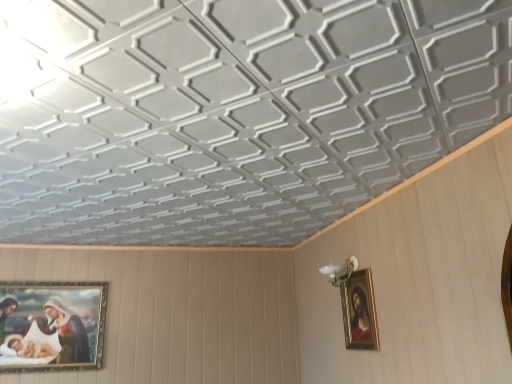
I want to click on gold-framed painting at upper right, which is the second picture frame from back to front, so click(359, 311).

How much space does gold-framed painting at upper right, which is the second picture frame from back to front, occupy horizontally?

1.71 inches.

Describe the element at coordinates (359, 311) in the screenshot. I see `gold-framed painting at upper right, placed as the first picture frame when sorted from front to back` at that location.

Describe the element at coordinates (52, 324) in the screenshot. I see `gold-framed painting at lower left, the second picture frame positioned from the front` at that location.

What is the approximate height of gold-framed painting at lower left, the second picture frame positioned from the front?

It is 28.13 inches.

Identify the location of gold-framed painting at lower left, the second picture frame from the right. This screenshot has height=384, width=512. (52, 324).

The height and width of the screenshot is (384, 512). I want to click on gold-framed painting at upper right, which is the second picture frame from back to front, so click(x=359, y=311).

Considering the relative positions of gold-framed painting at lower left, the second picture frame from the right, and gold-framed painting at upper right, which appears as the second picture frame when viewed from the left, in the image provided, is gold-framed painting at lower left, the second picture frame from the right, to the right of gold-framed painting at upper right, which appears as the second picture frame when viewed from the left, from the viewer's perspective?

Incorrect, gold-framed painting at lower left, the second picture frame from the right, is not on the right side of gold-framed painting at upper right, which appears as the second picture frame when viewed from the left.

Which object is closer to the camera taking this photo, gold-framed painting at lower left, the first picture frame positioned from the back, or gold-framed painting at upper right, which appears as the second picture frame when viewed from the left?

gold-framed painting at upper right, which appears as the second picture frame when viewed from the left, is in front.

Is point (97, 321) behind point (361, 348)?

Yes, it is behind point (361, 348).

From the image's perspective, which is below, gold-framed painting at lower left, the second picture frame from the right, or gold-framed painting at upper right, which appears as the second picture frame when viewed from the left?

gold-framed painting at lower left, the second picture frame from the right, from the image's perspective.

From a real-world perspective, is gold-framed painting at lower left, the second picture frame from the right, below gold-framed painting at upper right, acting as the 1th picture frame starting from the right?

Correct, in the physical world, gold-framed painting at lower left, the second picture frame from the right, is lower than gold-framed painting at upper right, acting as the 1th picture frame starting from the right.

Between gold-framed painting at lower left, placed as the 1th picture frame when sorted from left to right, and gold-framed painting at upper right, placed as the first picture frame when sorted from front to back, which one has smaller width?

gold-framed painting at lower left, placed as the 1th picture frame when sorted from left to right.

Considering the sizes of objects gold-framed painting at lower left, the second picture frame positioned from the front, and gold-framed painting at upper right, acting as the 1th picture frame starting from the right, in the image provided, who is shorter, gold-framed painting at lower left, the second picture frame positioned from the front, or gold-framed painting at upper right, acting as the 1th picture frame starting from the right,?

gold-framed painting at upper right, acting as the 1th picture frame starting from the right.

Can you confirm if gold-framed painting at lower left, the first picture frame positioned from the back, is smaller than gold-framed painting at upper right, acting as the 1th picture frame starting from the right?

Actually, gold-framed painting at lower left, the first picture frame positioned from the back, might be larger than gold-framed painting at upper right, acting as the 1th picture frame starting from the right.

Looking at this image, is gold-framed painting at lower left, the second picture frame positioned from the front, spatially inside gold-framed painting at upper right, which is the second picture frame from back to front, or outside of it?

gold-framed painting at lower left, the second picture frame positioned from the front, is outside gold-framed painting at upper right, which is the second picture frame from back to front.

Based on the photo, is the surface of gold-framed painting at lower left, the first picture frame positioned from the back, in direct contact with gold-framed painting at upper right, placed as the first picture frame when sorted from front to back?

No, gold-framed painting at lower left, the first picture frame positioned from the back, is not touching gold-framed painting at upper right, placed as the first picture frame when sorted from front to back.

Does gold-framed painting at lower left, the second picture frame from the right, turn towards gold-framed painting at upper right, which appears as the second picture frame when viewed from the left?

No.

Can you tell me how much gold-framed painting at lower left, placed as the 1th picture frame when sorted from left to right, and gold-framed painting at upper right, placed as the first picture frame when sorted from front to back, differ in facing direction?

The facing directions of gold-framed painting at lower left, placed as the 1th picture frame when sorted from left to right, and gold-framed painting at upper right, placed as the first picture frame when sorted from front to back, are 89.8 degrees apart.

In the image, there is a gold-framed painting at upper right, placed as the first picture frame when sorted from front to back. In order to click on picture frame below it (from the image's perspective) in this screenshot , I will do `click(52, 324)`.

From the picture: Considering the relative positions of gold-framed painting at upper right, acting as the 1th picture frame starting from the right, and gold-framed painting at lower left, the second picture frame from the right, in the image provided, is gold-framed painting at upper right, acting as the 1th picture frame starting from the right, to the left of gold-framed painting at lower left, the second picture frame from the right, from the viewer's perspective?

In fact, gold-framed painting at upper right, acting as the 1th picture frame starting from the right, is to the right of gold-framed painting at lower left, the second picture frame from the right.

Between gold-framed painting at upper right, acting as the 1th picture frame starting from the right, and gold-framed painting at lower left, the first picture frame positioned from the back, which one is positioned behind?

Positioned behind is gold-framed painting at lower left, the first picture frame positioned from the back.

Between point (358, 328) and point (10, 354), which one is positioned behind?

The point (10, 354) is behind.

From the image's perspective, which object appears higher, gold-framed painting at upper right, placed as the first picture frame when sorted from front to back, or gold-framed painting at lower left, the second picture frame from the right?

From the image's view, gold-framed painting at upper right, placed as the first picture frame when sorted from front to back, is above.

From a real-world perspective, is gold-framed painting at upper right, which is the second picture frame from back to front, under gold-framed painting at lower left, the first picture frame positioned from the back?

No, from a real-world perspective, gold-framed painting at upper right, which is the second picture frame from back to front, is not under gold-framed painting at lower left, the first picture frame positioned from the back.

From the picture: Does gold-framed painting at upper right, which appears as the second picture frame when viewed from the left, have a greater width compared to gold-framed painting at lower left, the second picture frame positioned from the front?

Indeed, gold-framed painting at upper right, which appears as the second picture frame when viewed from the left, has a greater width compared to gold-framed painting at lower left, the second picture frame positioned from the front.

From their relative heights in the image, would you say gold-framed painting at upper right, which is the second picture frame from back to front, is taller or shorter than gold-framed painting at lower left, placed as the 1th picture frame when sorted from left to right?

Clearly, gold-framed painting at upper right, which is the second picture frame from back to front, is shorter compared to gold-framed painting at lower left, placed as the 1th picture frame when sorted from left to right.

Is gold-framed painting at upper right, which appears as the second picture frame when viewed from the left, bigger or smaller than gold-framed painting at lower left, placed as the 1th picture frame when sorted from left to right?

Considering their sizes, gold-framed painting at upper right, which appears as the second picture frame when viewed from the left, takes up less space than gold-framed painting at lower left, placed as the 1th picture frame when sorted from left to right.

Would you say gold-framed painting at upper right, which is the second picture frame from back to front, is outside gold-framed painting at lower left, the second picture frame positioned from the front?

Yes, gold-framed painting at upper right, which is the second picture frame from back to front, is not within gold-framed painting at lower left, the second picture frame positioned from the front.

Is gold-framed painting at upper right, which is the second picture frame from back to front, far from gold-framed painting at lower left, the second picture frame from the right?

gold-framed painting at upper right, which is the second picture frame from back to front, is positioned a significant distance from gold-framed painting at lower left, the second picture frame from the right.

Is gold-framed painting at upper right, acting as the 1th picture frame starting from the right, oriented away from gold-framed painting at lower left, the second picture frame positioned from the front?

That's not correct — gold-framed painting at upper right, acting as the 1th picture frame starting from the right, is not looking away from gold-framed painting at lower left, the second picture frame positioned from the front.

What's the angular difference between gold-framed painting at upper right, which is the second picture frame from back to front, and gold-framed painting at lower left, the second picture frame positioned from the front,'s facing directions?

The angular difference between gold-framed painting at upper right, which is the second picture frame from back to front, and gold-framed painting at lower left, the second picture frame positioned from the front, is 89.8 degrees.

Measure the distance between gold-framed painting at upper right, which is the second picture frame from back to front, and gold-framed painting at lower left, the first picture frame positioned from the back.

gold-framed painting at upper right, which is the second picture frame from back to front, is 7.55 feet from gold-framed painting at lower left, the first picture frame positioned from the back.

The height and width of the screenshot is (384, 512). Find the location of `picture frame that appears on the right of gold-framed painting at lower left, the first picture frame positioned from the back`. picture frame that appears on the right of gold-framed painting at lower left, the first picture frame positioned from the back is located at coordinates (359, 311).

Locate an element on the screen. The width and height of the screenshot is (512, 384). picture frame located above the gold-framed painting at lower left, placed as the 1th picture frame when sorted from left to right (from a real-world perspective) is located at coordinates (359, 311).

In the image, there is a gold-framed painting at upper right, acting as the 1th picture frame starting from the right. Where is `picture frame below it (from the image's perspective)`? The width and height of the screenshot is (512, 384). picture frame below it (from the image's perspective) is located at coordinates (52, 324).